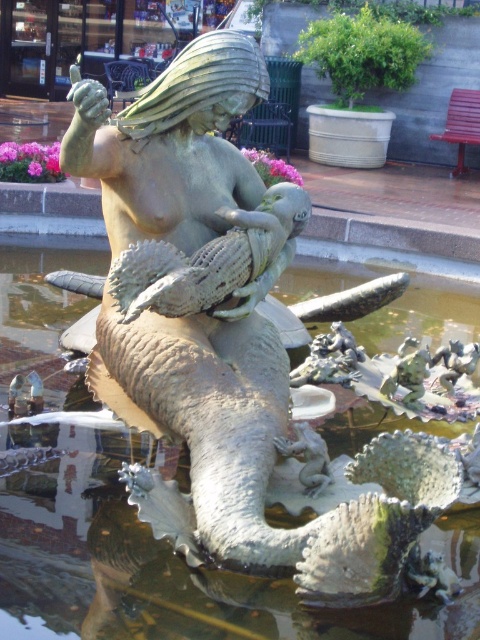
Which is behind, point (122, 531) or point (279, 216)?

Positioned behind is point (279, 216).

Is greenish stone water at center shorter than matte bronze fish at center?

Incorrect, greenish stone water at center's height does not fall short of matte bronze fish at center's.

Is point (27, 524) closer to camera compared to point (292, 230)?

Yes.

Where is `greenish stone water at center`? The width and height of the screenshot is (480, 640). greenish stone water at center is located at coordinates (169, 561).